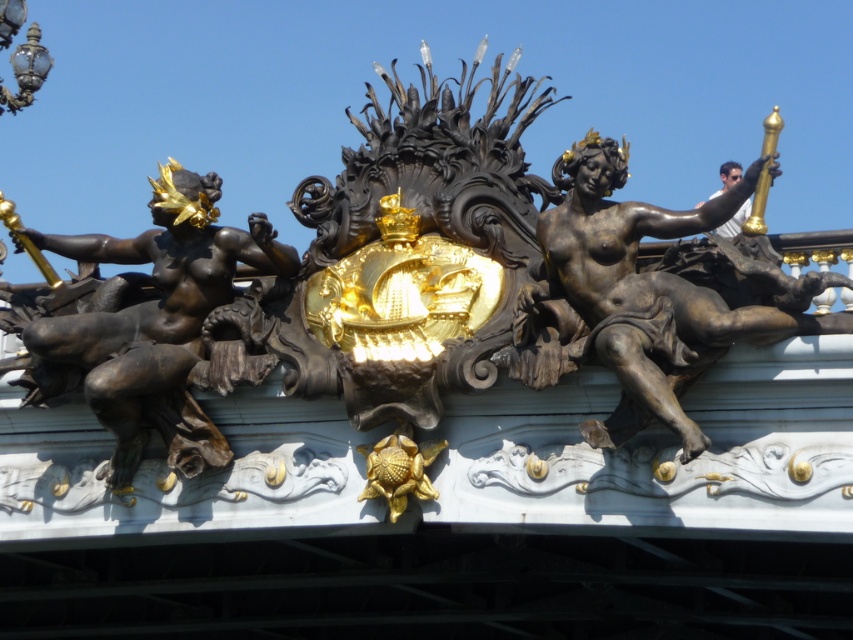
Does bronze statue at left appear over bronze statue at right?

No, bronze statue at left is not above bronze statue at right.

Who is taller, bronze statue at left or bronze statue at right?

Standing taller between the two is bronze statue at left.

Image resolution: width=853 pixels, height=640 pixels. Describe the element at coordinates (146, 323) in the screenshot. I see `bronze statue at left` at that location.

Identify the location of bronze statue at left. This screenshot has height=640, width=853. click(x=146, y=323).